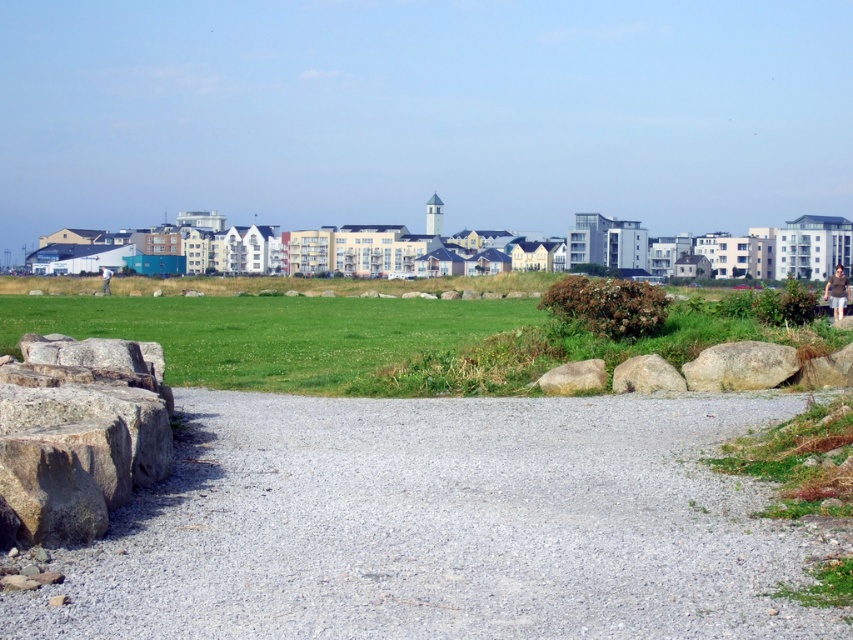
Question: Estimate the real-world distances between objects in this image. Which object is closer to the brown rough stone at lower left?

Choices:
 (A) green grass at lower center
 (B) smooth gray rock at right
 (C) gray rough boulder at right

Answer: (C)

Question: Does brown rough stone at lower left appear under smooth gray rock at center-right?

Choices:
 (A) yes
 (B) no

Answer: (B)

Question: Does gray rough boulder at right appear over brown rough boulder at center?

Choices:
 (A) yes
 (B) no

Answer: (A)

Question: Can you confirm if gray rough boulder at right is smaller than brown rough boulder at center?

Choices:
 (A) yes
 (B) no

Answer: (B)

Question: Which of the following is the farthest from the observer?

Choices:
 (A) brown rough stone at lower left
 (B) brown rough boulder at center
 (C) gray gravel path at center
 (D) smooth gray rock at right

Answer: (B)

Question: Which is nearer to the gray gravel path at center?

Choices:
 (A) brown rough boulder at center
 (B) smooth gray rock at right
 (C) green grass at lower center
 (D) gray rough boulder at right

Answer: (D)